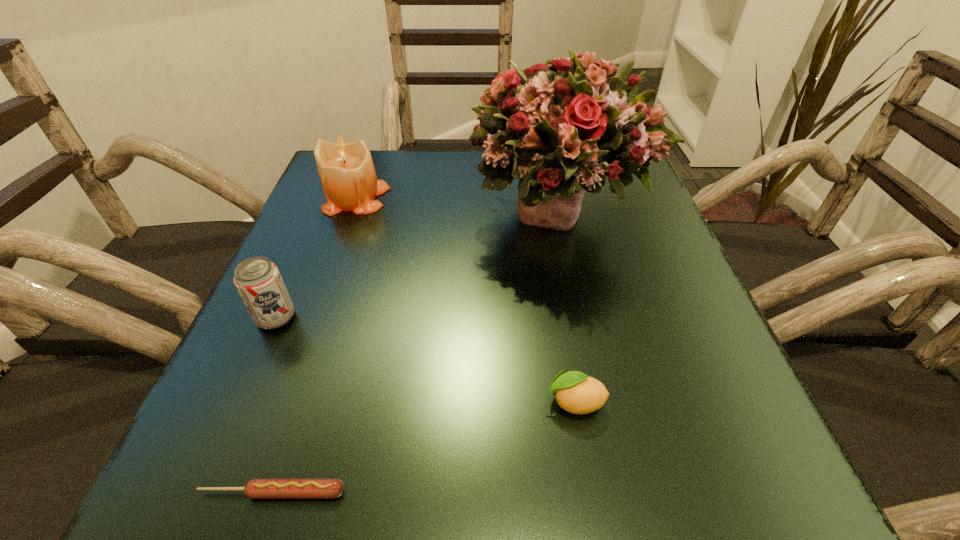
I want to click on vacant region located on the back of the beer can, so click(306, 249).

Locate an element on the screen. blank space located with leaves positioned above the lemon is located at coordinates (323, 401).

What are the coordinates of `free space located 0.230m with leaves positioned above the lemon` in the screenshot? It's located at (373, 401).

This screenshot has width=960, height=540. In order to click on free point located 0.300m with leaves positioned above the lemon in this screenshot , I will do `click(323, 401)`.

Where is `free point located 0.260m on the back of the shortest object`? The image size is (960, 540). free point located 0.260m on the back of the shortest object is located at coordinates (329, 317).

Locate an element on the screen. Image resolution: width=960 pixels, height=540 pixels. bouquet that is at the far edge is located at coordinates (563, 127).

I want to click on candle situated at the far edge, so click(x=347, y=175).

Where is `object that is at the near edge`? object that is at the near edge is located at coordinates (256, 488).

The image size is (960, 540). I want to click on candle that is at the left edge, so click(347, 175).

Find the location of a particular element. This screenshot has width=960, height=540. beer can present at the left edge is located at coordinates (258, 281).